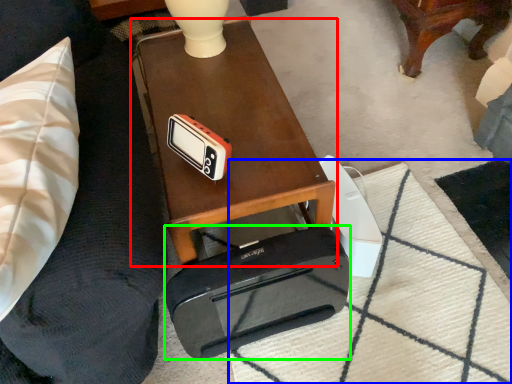
Question: Based on their relative distances, which object is farther from table (highlighted by a red box)? Choose from mat (highlighted by a blue box) and cassette (highlighted by a green box).

Choices:
 (A) mat
 (B) cassette

Answer: (A)